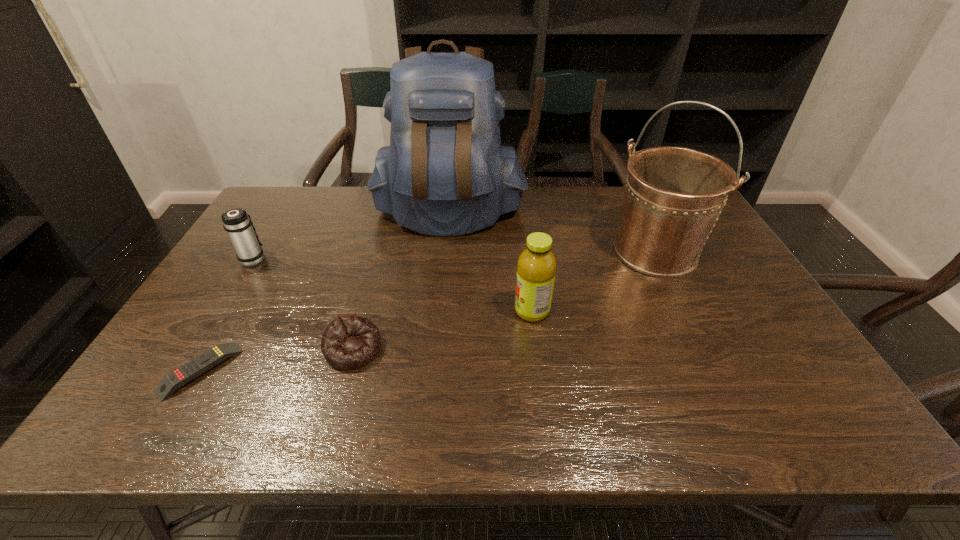
Find the location of `free point that satisfies the following two spatial constraints: 1. on the front label of the third nearest object; 2. on the front side of the remote control`. free point that satisfies the following two spatial constraints: 1. on the front label of the third nearest object; 2. on the front side of the remote control is located at coordinates (540, 370).